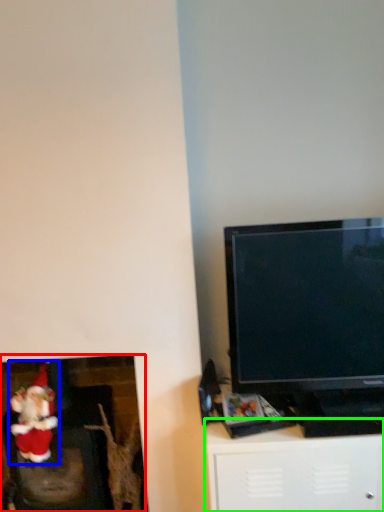
Question: Which object is the farthest from fireplace (highlighted by a red box)? Choose among these: santa claus (highlighted by a blue box) or furniture (highlighted by a green box).

Choices:
 (A) santa claus
 (B) furniture

Answer: (B)